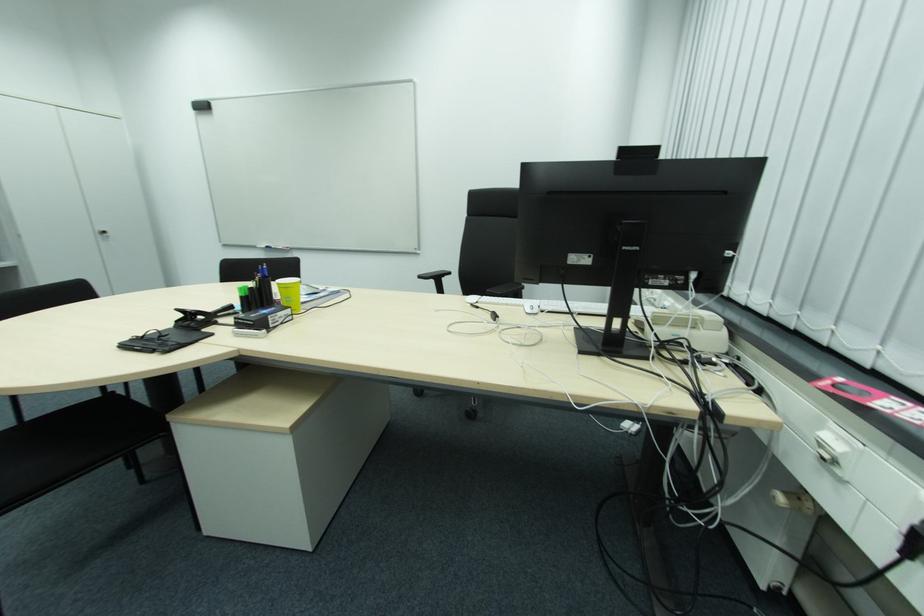
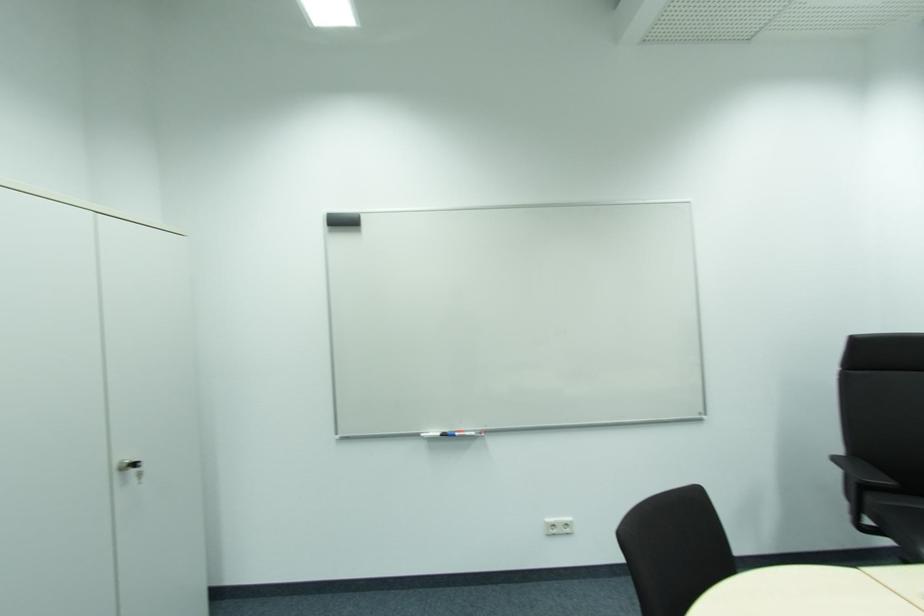
In the second image, find the point that corresponds to pixel 111 233 in the first image.

(140, 464)